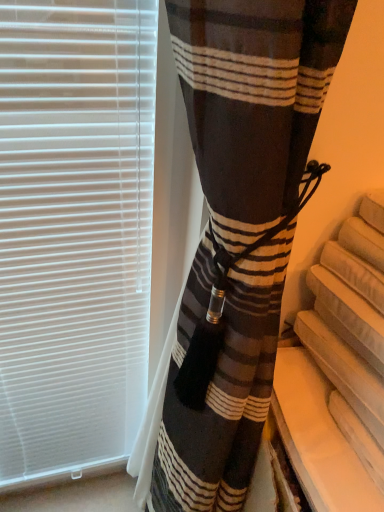
Image resolution: width=384 pixels, height=512 pixels. Describe the element at coordinates (74, 234) in the screenshot. I see `white plastic blinds at left` at that location.

The width and height of the screenshot is (384, 512). I want to click on white plastic blinds at left, so click(x=74, y=234).

Identify the location of white plastic blinds at left. (74, 234).